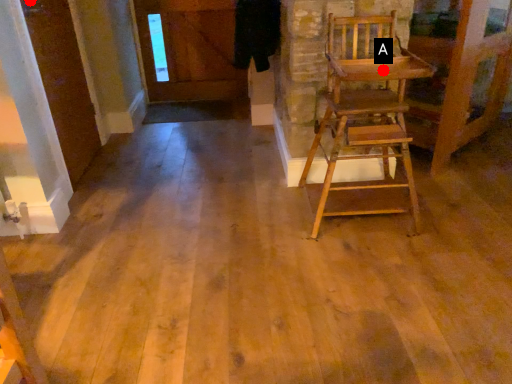
Question: Two points are circled on the image, labeled by A and B beside each circle. Which point is farther from the camera taking this photo?

Choices:
 (A) A is further
 (B) B is further

Answer: (B)